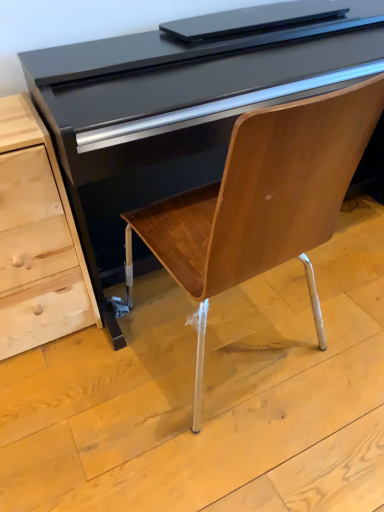
Question: From a real-world perspective, is light wood chest of drawers at left located higher than glossy black piano at center?

Choices:
 (A) yes
 (B) no

Answer: (B)

Question: Are light wood chest of drawers at left and glossy black piano at center beside each other?

Choices:
 (A) yes
 (B) no

Answer: (B)

Question: Is light wood chest of drawers at left in front of glossy black piano at center?

Choices:
 (A) yes
 (B) no

Answer: (B)

Question: Considering the relative positions of light wood chest of drawers at left and glossy black piano at center in the image provided, is light wood chest of drawers at left to the left of glossy black piano at center from the viewer's perspective?

Choices:
 (A) no
 (B) yes

Answer: (B)

Question: Considering the relative sizes of light wood chest of drawers at left and glossy black piano at center in the image provided, is light wood chest of drawers at left taller than glossy black piano at center?

Choices:
 (A) no
 (B) yes

Answer: (A)

Question: Can you confirm if light wood chest of drawers at left is smaller than glossy black piano at center?

Choices:
 (A) no
 (B) yes

Answer: (B)

Question: Can you confirm if glossy black piano at center is positioned to the right of light wood chest of drawers at left?

Choices:
 (A) yes
 (B) no

Answer: (A)

Question: Can light wood chest of drawers at left be found inside glossy black piano at center?

Choices:
 (A) no
 (B) yes

Answer: (A)

Question: Are glossy black piano at center and light wood chest of drawers at left beside each other?

Choices:
 (A) no
 (B) yes

Answer: (A)

Question: Considering the relative sizes of glossy black piano at center and light wood chest of drawers at left in the image provided, is glossy black piano at center taller than light wood chest of drawers at left?

Choices:
 (A) no
 (B) yes

Answer: (B)

Question: From the image's perspective, is glossy black piano at center above light wood chest of drawers at left?

Choices:
 (A) no
 (B) yes

Answer: (B)

Question: Does glossy black piano at center have a smaller size compared to light wood chest of drawers at left?

Choices:
 (A) no
 (B) yes

Answer: (A)

Question: Considering the positions of glossy black piano at center and light wood chest of drawers at left in the image, is glossy black piano at center wider or thinner than light wood chest of drawers at left?

Choices:
 (A) thin
 (B) wide

Answer: (B)